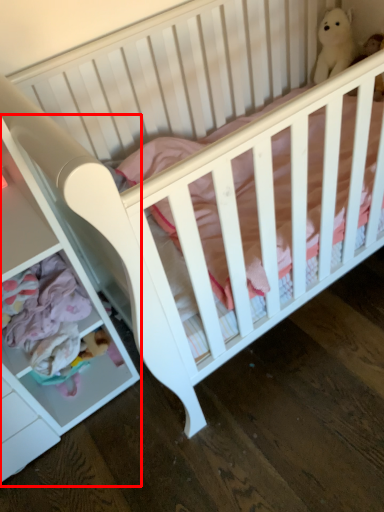
Question: From the image, what is the correct spatial relationship of dresser (annotated by the red box) in relation to figurine?

Choices:
 (A) right
 (B) left

Answer: (B)